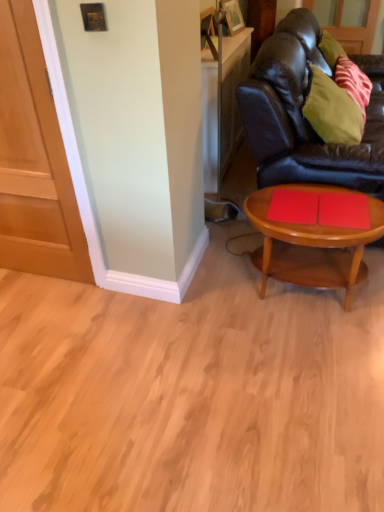
The width and height of the screenshot is (384, 512). I want to click on free point below wooden coffee table at lower right (from a real-world perspective), so click(297, 296).